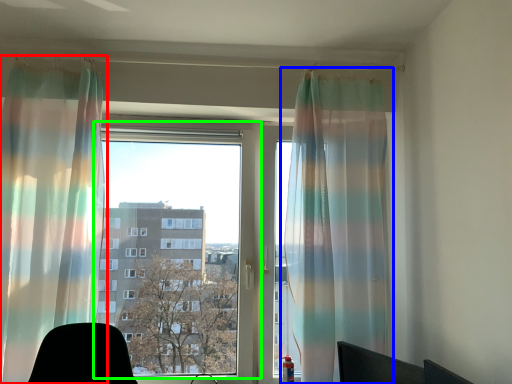
Question: Which object is positioned farthest from curtain (highlighted by a red box)? Select from curtain (highlighted by a blue box) and window (highlighted by a green box).

Choices:
 (A) curtain
 (B) window

Answer: (A)